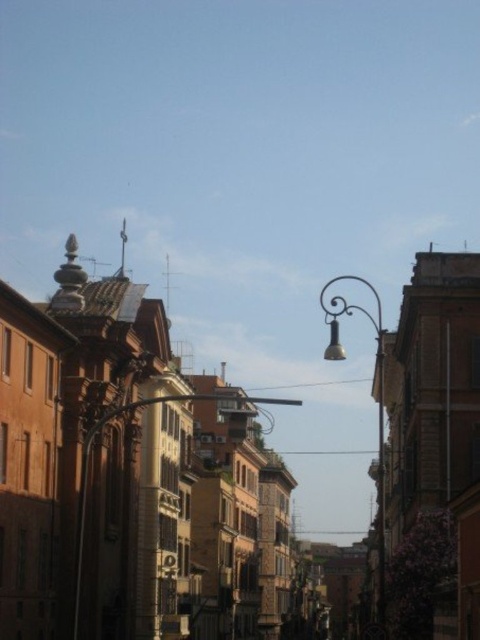
Question: Which point is closer to the camera?

Choices:
 (A) metallic streetlight at center
 (B) metallic curved street light at upper center

Answer: (B)

Question: Is metallic curved street light at upper center below metallic streetlight at center?

Choices:
 (A) yes
 (B) no

Answer: (A)

Question: Can you confirm if metallic curved street light at upper center is positioned to the left of metallic streetlight at center?

Choices:
 (A) yes
 (B) no

Answer: (B)

Question: Which point appears closest to the camera in this image?

Choices:
 (A) (331, 342)
 (B) (248, 396)

Answer: (A)

Question: Is metallic curved street light at upper center to the left of metallic streetlight at center from the viewer's perspective?

Choices:
 (A) yes
 (B) no

Answer: (B)